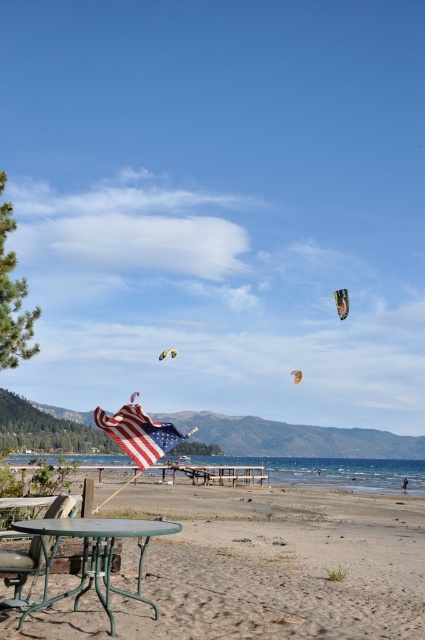
Is point (144, 420) behind point (28, 564)?

Yes, it is behind point (28, 564).

I want to click on american flag at center, so click(x=138, y=433).

Who is lower down, sandy beach at lower center or yellow-green fabric kite at upper center?

sandy beach at lower center

Measure the distance between point (x=373, y=540) and camera.

A distance of 41.38 feet exists between point (x=373, y=540) and camera.

Find the location of `sandy beach at lower center`. sandy beach at lower center is located at coordinates (277, 564).

Who is taller, american flag at center or yellow-green fabric kite at upper center?

With more height is american flag at center.

Does american flag at center appear over yellow-green fabric kite at upper center?

Incorrect, american flag at center is not positioned above yellow-green fabric kite at upper center.

Who is more forward, [127,422] or [173,355]?

Point [127,422]

Find the location of a particular element. The width and height of the screenshot is (425, 640). american flag at center is located at coordinates (138, 433).